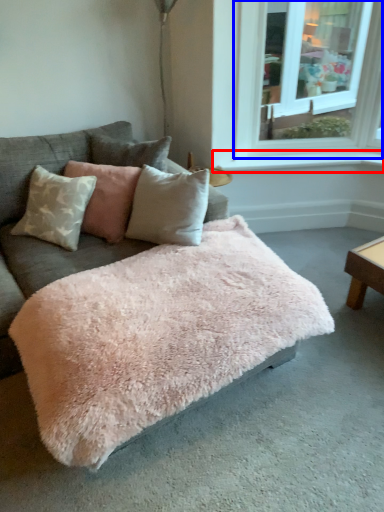
Question: Which object appears farthest to the camera in this image, window sill (highlighted by a red box) or window (highlighted by a blue box)?

Choices:
 (A) window sill
 (B) window

Answer: (A)